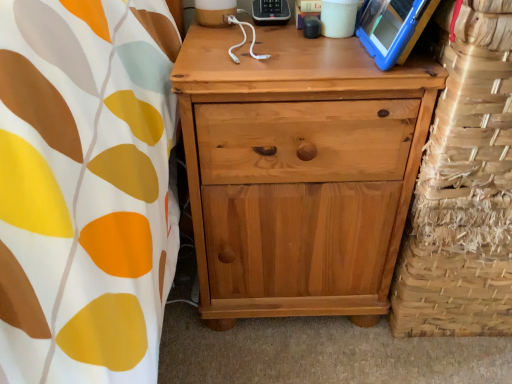
Question: From a real-world perspective, is natural wood chest of drawers at center physically located above or below woven straw basket at right?

Choices:
 (A) above
 (B) below

Answer: (B)

Question: Is natural wood chest of drawers at center to the left or to the right of woven straw basket at right in the image?

Choices:
 (A) right
 (B) left

Answer: (B)

Question: Is point (302, 173) closer or farther from the camera than point (439, 192)?

Choices:
 (A) farther
 (B) closer

Answer: (A)

Question: In terms of width, does woven straw basket at right look wider or thinner when compared to natural wood chest of drawers at center?

Choices:
 (A) wide
 (B) thin

Answer: (B)

Question: Do you think woven straw basket at right is within natural wood chest of drawers at center, or outside of it?

Choices:
 (A) inside
 (B) outside

Answer: (B)

Question: From the image's perspective, is woven straw basket at right above or below natural wood chest of drawers at center?

Choices:
 (A) above
 (B) below

Answer: (A)

Question: From a real-world perspective, relative to natural wood chest of drawers at center, is woven straw basket at right vertically above or below?

Choices:
 (A) above
 (B) below

Answer: (A)